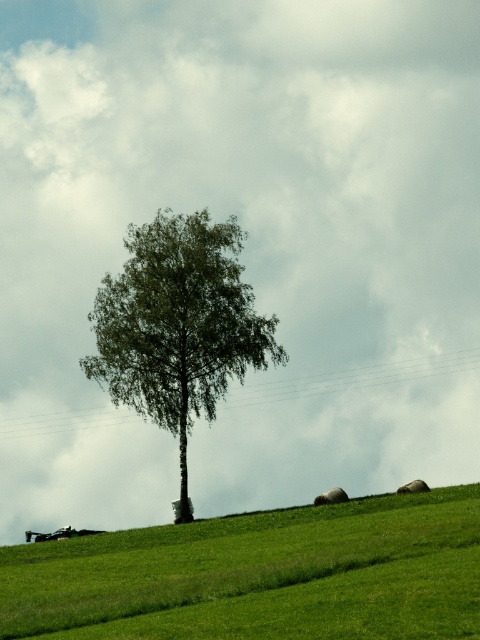
Question: Is green grassy hillside at lower center positioned before green leafy tree at center?

Choices:
 (A) yes
 (B) no

Answer: (A)

Question: Is green grassy hillside at lower center to the right of green leafy tree at center from the viewer's perspective?

Choices:
 (A) yes
 (B) no

Answer: (A)

Question: Which object is farther from the camera taking this photo?

Choices:
 (A) green leafy tree at center
 (B) green grassy hillside at lower center

Answer: (A)

Question: Does green grassy hillside at lower center appear on the right side of green leafy tree at center?

Choices:
 (A) no
 (B) yes

Answer: (B)

Question: Which point appears farthest from the camera in this image?

Choices:
 (A) (199, 605)
 (B) (155, 340)

Answer: (B)